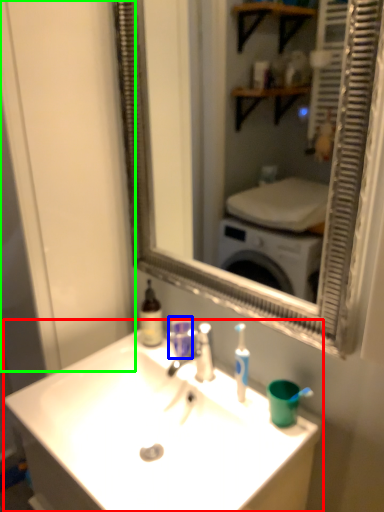
Question: Which object is positioned closest to sink (highlighted by a red box)? Select from mouthwash (highlighted by a blue box) and glass door (highlighted by a green box).

Choices:
 (A) mouthwash
 (B) glass door

Answer: (A)